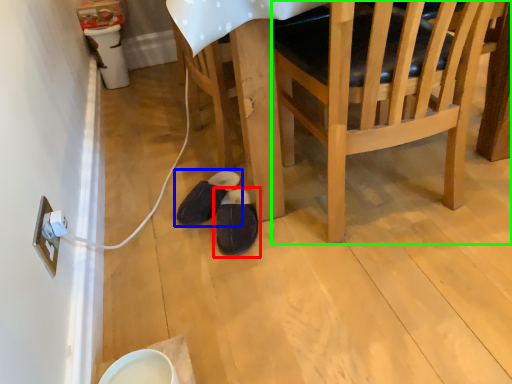
Question: Based on their relative distances, which object is farther from footwear (highlighted by a red box)? Choose from footwear (highlighted by a blue box) and chair (highlighted by a green box).

Choices:
 (A) footwear
 (B) chair

Answer: (B)